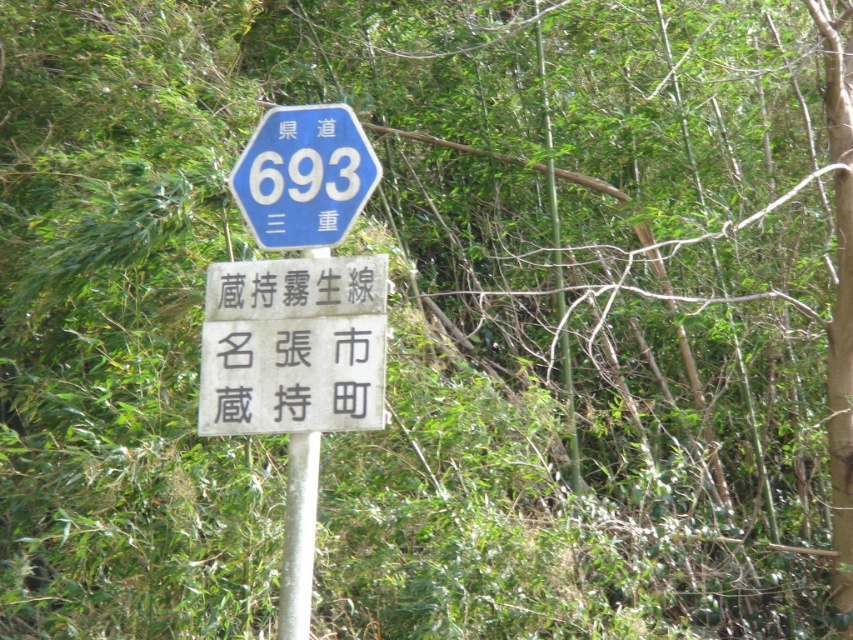
Does white stone sign at center appear under blue plastic hexagonal sign at upper center?

Indeed, white stone sign at center is positioned under blue plastic hexagonal sign at upper center.

Does white stone sign at center have a greater width compared to blue plastic hexagonal sign at upper center?

Indeed, white stone sign at center has a greater width compared to blue plastic hexagonal sign at upper center.

At what (x,y) coordinates should I click in order to perform the action: click on white stone sign at center. Please return your answer as a coordinate pair (x, y). Looking at the image, I should click on (293, 346).

Who is higher up, white stone sign at center or white metallic pole at center?

white stone sign at center is higher up.

Which is below, white stone sign at center or white metallic pole at center?

Positioned lower is white metallic pole at center.

The height and width of the screenshot is (640, 853). What are the coordinates of `white stone sign at center` in the screenshot? It's located at (293, 346).

Does blue plastic hexagonal sign at upper center come behind white metallic pole at center?

Yes, it is.

Who is more forward, (x=247, y=157) or (x=316, y=438)?

Point (x=316, y=438) is more forward.

Between point (331, 132) and point (310, 529), which one is positioned behind?

The point (331, 132) is behind.

At what (x,y) coordinates should I click in order to perform the action: click on blue plastic hexagonal sign at upper center. Please return your answer as a coordinate pair (x, y). The height and width of the screenshot is (640, 853). Looking at the image, I should click on (305, 177).